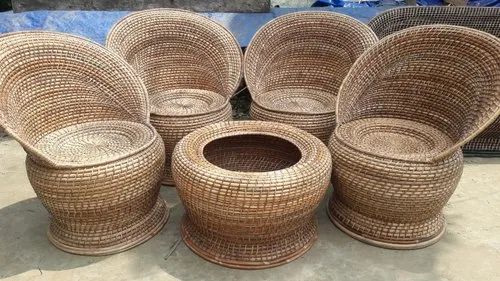
Where is `the second from left chair back`? The image size is (500, 281). the second from left chair back is located at coordinates (162, 60).